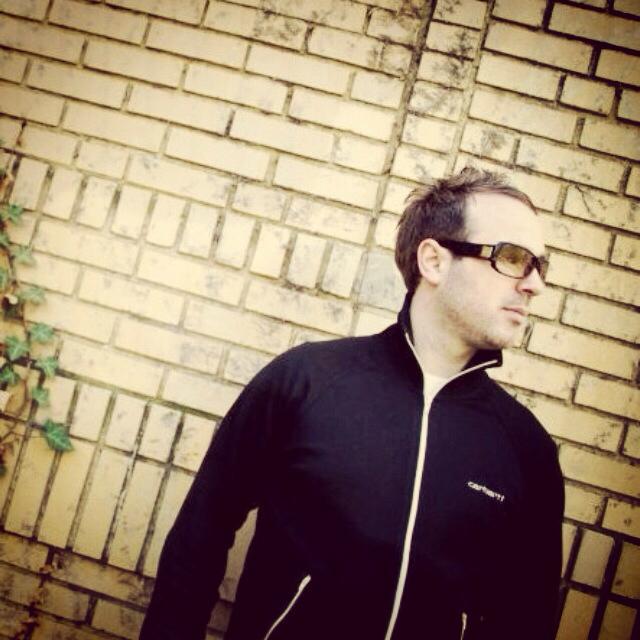
The height and width of the screenshot is (640, 640). I want to click on light yellow brick wall, so click(x=224, y=150).